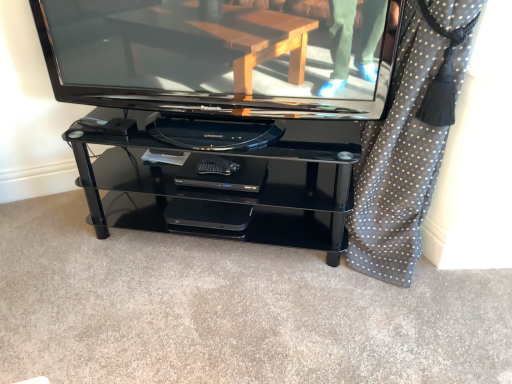
Question: Does point 237,168 appear closer or farther from the camera than point 110,26?

Choices:
 (A) closer
 (B) farther

Answer: (B)

Question: From a real-world perspective, is black plastic dvd player at center physically located above or below glossy black television at center?

Choices:
 (A) above
 (B) below

Answer: (B)

Question: Estimate the real-world distances between objects in this image. Which object is closer to the glossy black television at center?

Choices:
 (A) polka dot fabric at right
 (B) black plastic dvd player at center

Answer: (B)

Question: Considering the real-world distances, which object is closest to the black plastic dvd player at center?

Choices:
 (A) glossy black television at center
 (B) polka dot fabric at right

Answer: (A)